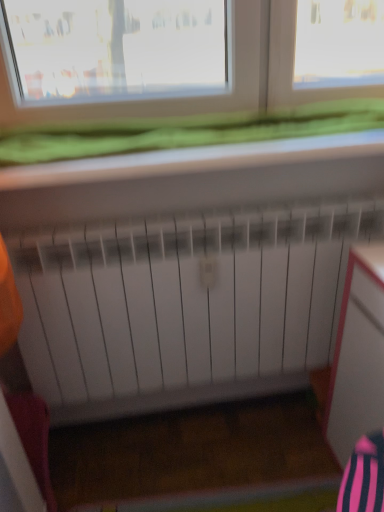
Where is `white matte radiator at center`? white matte radiator at center is located at coordinates (183, 306).

The image size is (384, 512). Describe the element at coordinates (183, 306) in the screenshot. I see `white matte radiator at center` at that location.

I want to click on white matte radiator at center, so click(x=183, y=306).